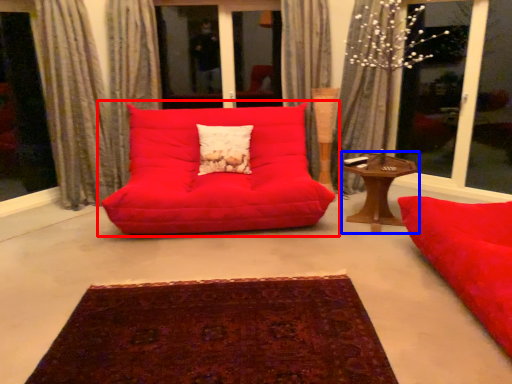
Question: Which object appears farthest to the camera in this image, studio couch (highlighted by a red box) or table (highlighted by a blue box)?

Choices:
 (A) studio couch
 (B) table

Answer: (B)